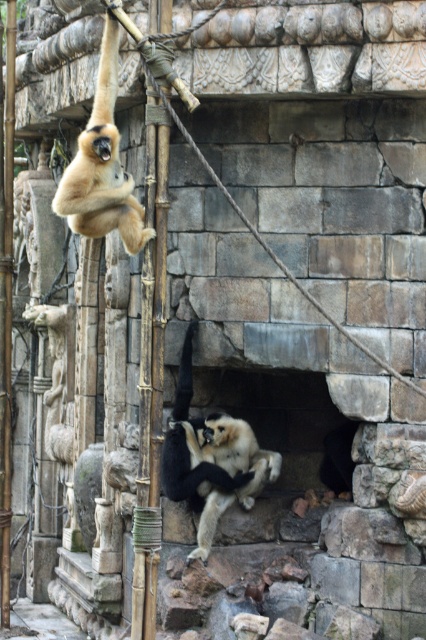
Question: Among these points, which one is nearest to the camera?

Choices:
 (A) (229, 468)
 (B) (109, 202)
 (C) (154, 109)
 (D) (5, 337)

Answer: (C)

Question: Which point appears closest to the camera in this image?

Choices:
 (A) (106, 173)
 (B) (201, 540)
 (C) (9, 172)

Answer: (A)

Question: In this image, where is bamboo pole at left located relative to light beige fur at upper left?

Choices:
 (A) right
 (B) left

Answer: (A)

Question: Is the position of light beige fur at upper left less distant than that of bamboo pole at center?

Choices:
 (A) no
 (B) yes

Answer: (B)

Question: Is bamboo pole at left further to the viewer compared to light beige fur at center?

Choices:
 (A) yes
 (B) no

Answer: (B)

Question: Which object appears closest to the camera in this image?

Choices:
 (A) light beige fur at upper left
 (B) light beige fur at center
 (C) bamboo pole at center
 (D) bamboo pole at left

Answer: (D)